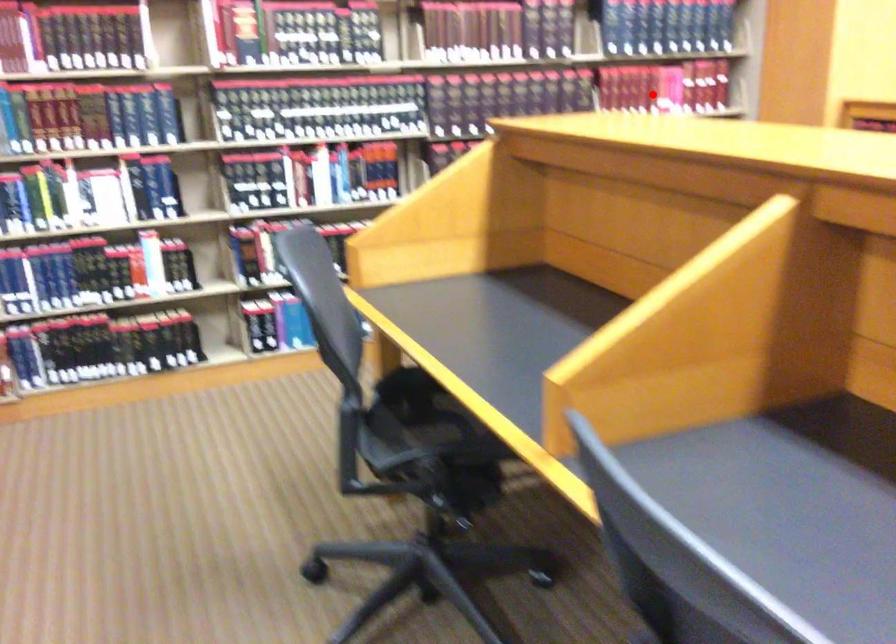
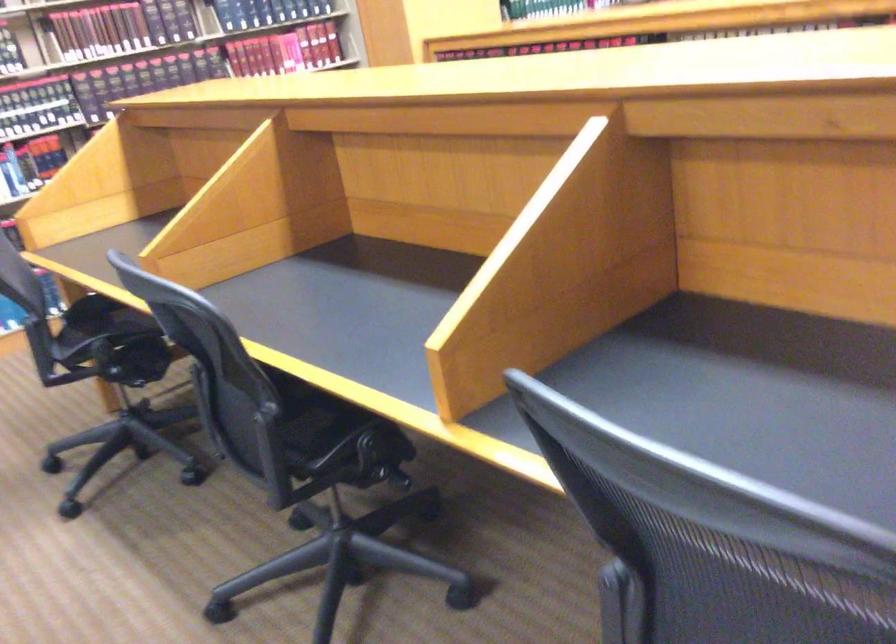
Locate, in the second image, the point that corresponds to the highlighted location in the first image.

(271, 55)